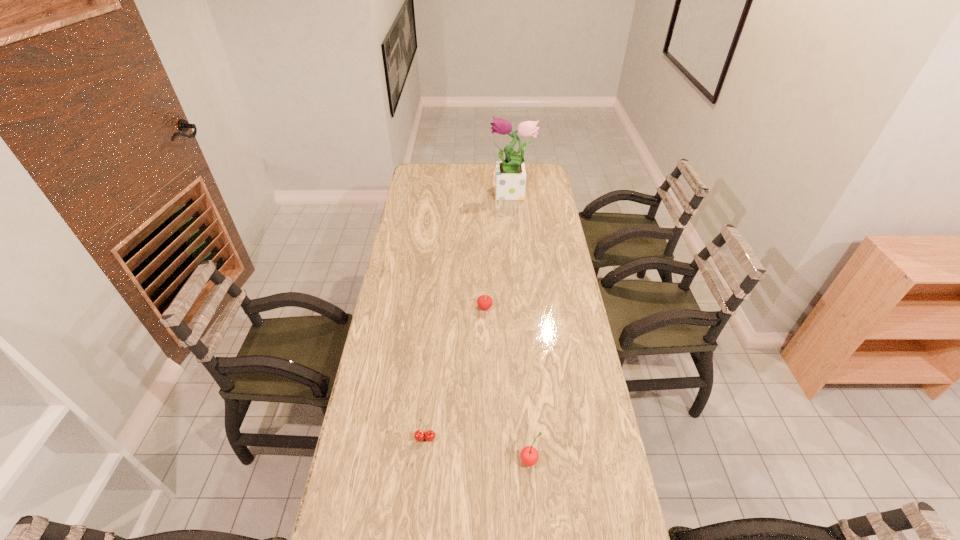
Identify the location of vacant space situated 0.060m on the front-facing side of the flower arrangement. Image resolution: width=960 pixels, height=540 pixels. (478, 195).

Where is `vacant space located on the left of the third nearest object`? The width and height of the screenshot is (960, 540). vacant space located on the left of the third nearest object is located at coordinates (410, 307).

This screenshot has height=540, width=960. I want to click on free location located 0.170m on the right of the rightmost cherry, so click(x=598, y=460).

Where is `vacant space located with the stems of the leftmost cherry pointing upwards`? The image size is (960, 540). vacant space located with the stems of the leftmost cherry pointing upwards is located at coordinates (420, 485).

Find the location of `object located in the far edge section of the desktop`. object located in the far edge section of the desktop is located at coordinates (510, 178).

I want to click on object that is at the right edge, so click(510, 178).

Locate an element on the screen. This screenshot has width=960, height=540. object that is at the far right corner is located at coordinates (510, 178).

Identify the location of free space at the far edge. The image size is (960, 540). (481, 165).

The height and width of the screenshot is (540, 960). I want to click on vacant space at the left edge of the desktop, so click(x=395, y=470).

What are the coordinates of `vacant space at the right edge` in the screenshot? It's located at (535, 210).